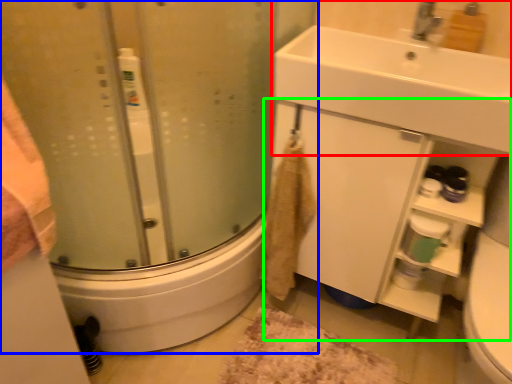
Question: Based on their relative distances, which object is farther from sink (highlighted by a red box)? Choose from shower door (highlighted by a blue box) and bathroom cabinet (highlighted by a green box).

Choices:
 (A) shower door
 (B) bathroom cabinet

Answer: (A)